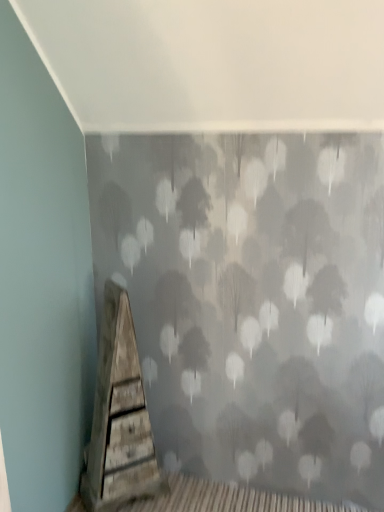
What do you see at coordinates (119, 417) in the screenshot? I see `worn wood pyramid at lower left` at bounding box center [119, 417].

Locate an element on the screen. The image size is (384, 512). worn wood pyramid at lower left is located at coordinates (119, 417).

Measure the distance between point (110, 380) and camera.

A distance of 5.75 feet exists between point (110, 380) and camera.

You are a GUI agent. You are given a task and a screenshot of the screen. Output one action in this format:
    pyautogui.click(x=<x>, y=<y>)
    Task: Click on the worn wood pyramid at lower left
    The width and height of the screenshot is (384, 512).
    Given the screenshot: What is the action you would take?
    pyautogui.click(x=119, y=417)